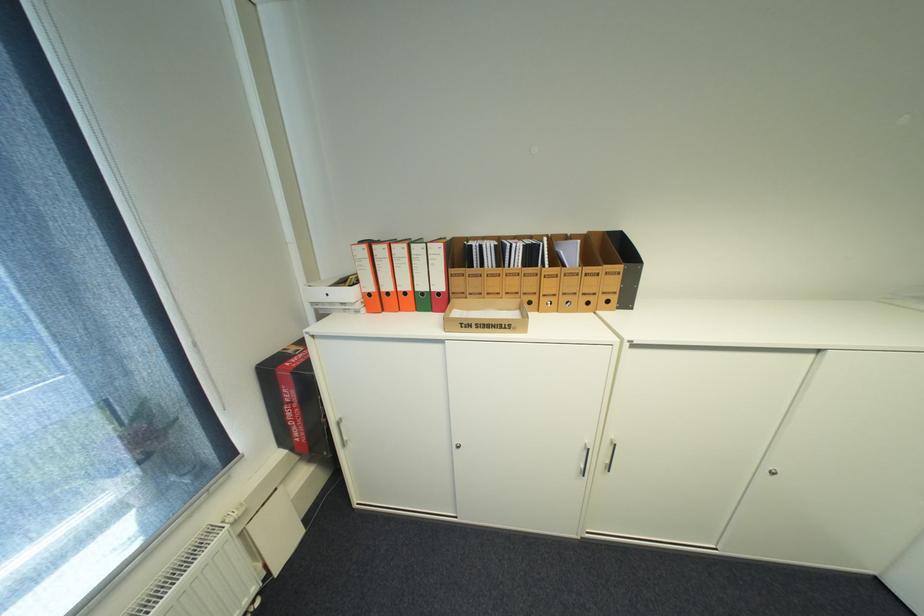
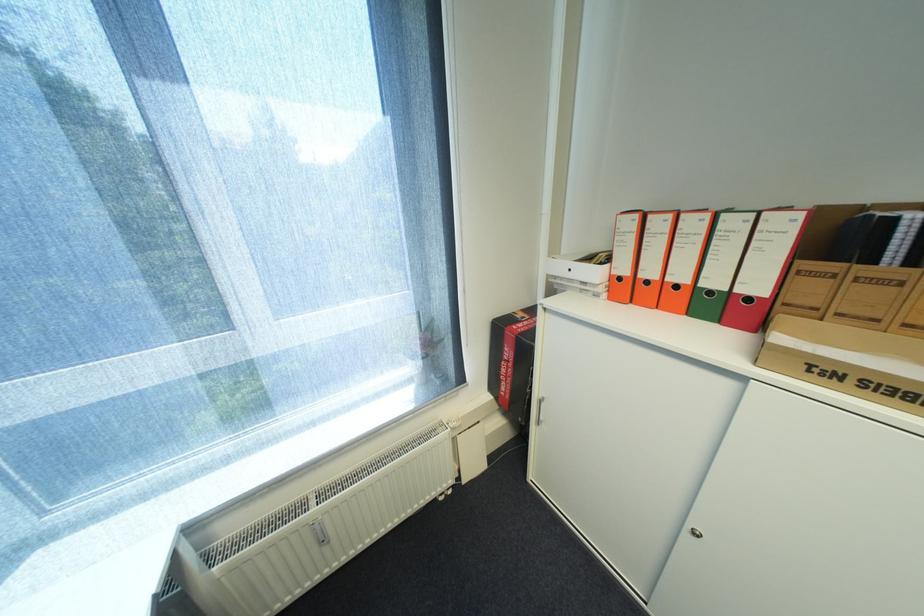
Where in the second image is the point corresponding to (412,294) from the first image?

(685, 286)